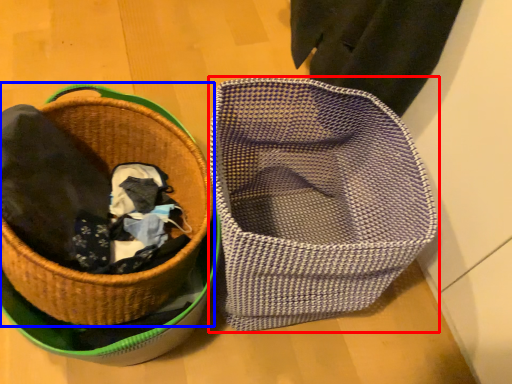
Question: Which point is closer to the camera, basket (highlighted by a red box) or picnic basket (highlighted by a blue box)?

Choices:
 (A) basket
 (B) picnic basket

Answer: (B)